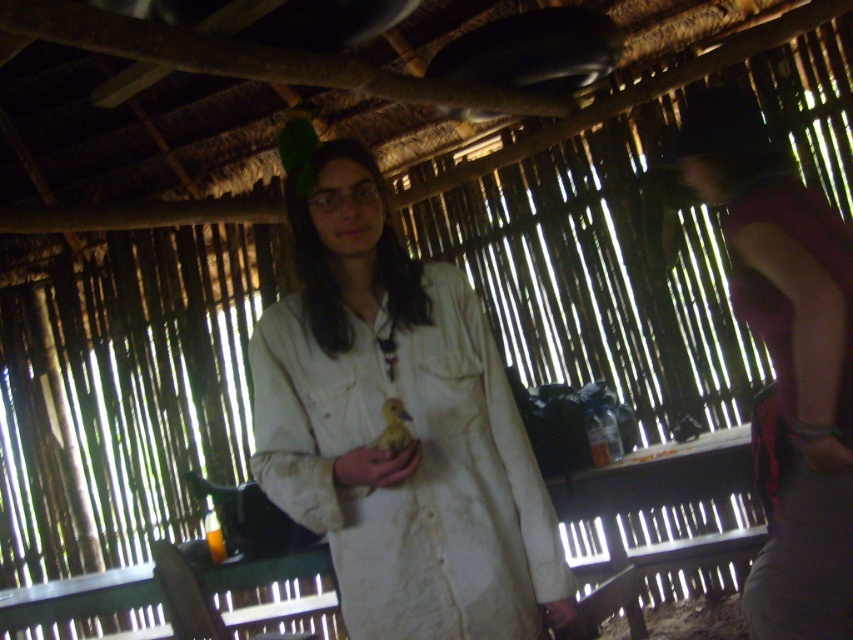
You are a delivery robot that is 1.5 meters tall. You are standing in front of the rustic hut and see the white cotton robe at right. Can you reach the top of the robe without climbing?

The white cotton robe at right is 1.72 meters away from you. Since the robe is only 1.72 meters away, and you are 1.5 meters tall, you cannot reach the top of the robe without climbing.